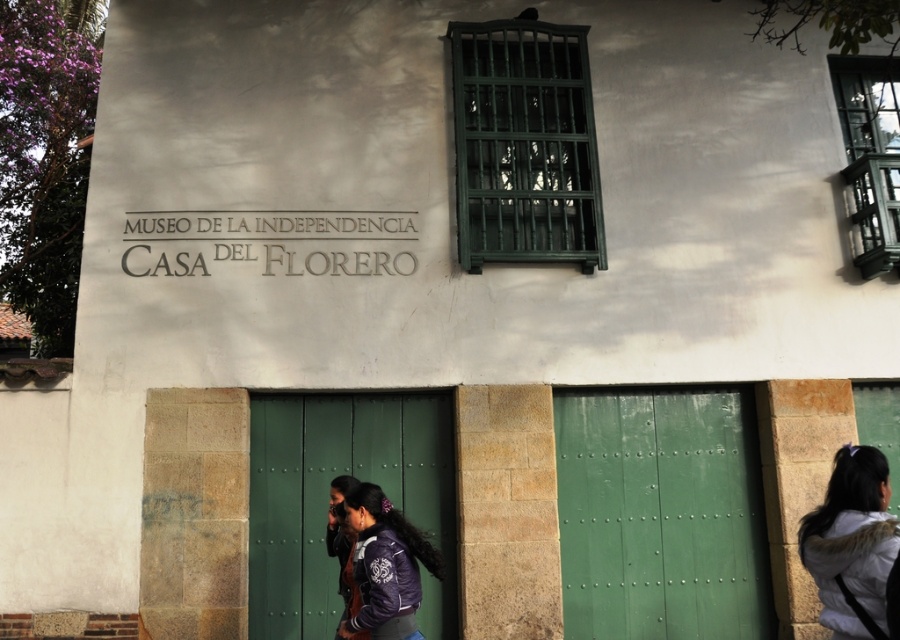
You are standing in front of the Museo de la Independencia Casa del Florero and notice two jackets hanging at the center. Which jacket is nearer to you, the purple matte jacket at center or the dark purple jacket at center?

The purple matte jacket at center is closer to the viewer than the dark purple jacket at center.

You are a fashion designer observing jackets in the image. Which jacket, the white fuzzy jacket at lower right or the dark purple jacket at center, has a smaller width when viewed from the front?

The white fuzzy jacket at lower right is thinner than the dark purple jacket at center, so the white fuzzy jacket at lower right has a smaller width when viewed from the front.